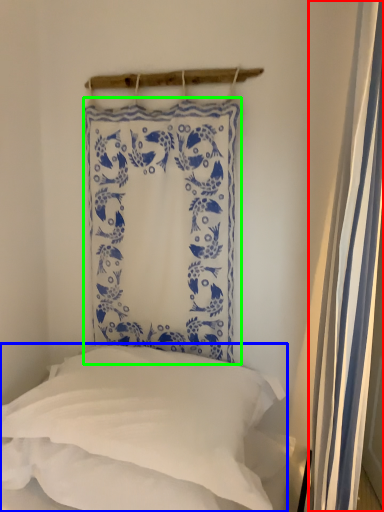
Question: Based on their relative distances, which object is nearer to shower curtain (highlighted by a red box)? Choose from pillow (highlighted by a blue box) and curtain (highlighted by a green box).

Choices:
 (A) pillow
 (B) curtain

Answer: (A)